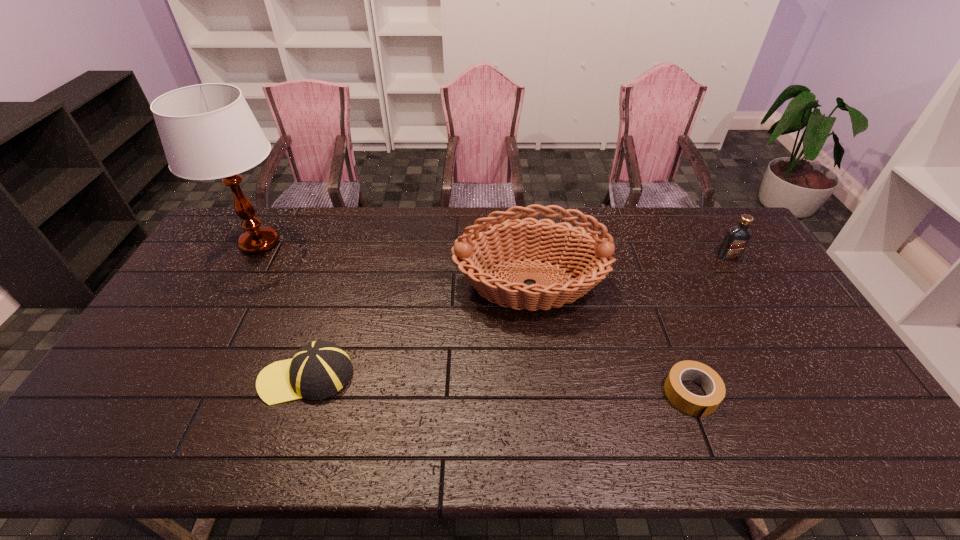
This screenshot has height=540, width=960. Identify the location of the leftmost object. (208, 131).

You are a GUI agent. You are given a task and a screenshot of the screen. Output one action in this format:
    pyautogui.click(x=<x>, y=<y>)
    Task: Click on the table lamp
    This screenshot has width=960, height=540.
    Given the screenshot: What is the action you would take?
    pyautogui.click(x=208, y=131)

Find the location of `basket`. basket is located at coordinates 584,254.

Where is `the third object from left to right`? This screenshot has width=960, height=540. the third object from left to right is located at coordinates (584, 254).

In order to click on the rightmost object in this screenshot , I will do `click(736, 239)`.

You are a GUI agent. You are given a task and a screenshot of the screen. Output one action in this format:
    pyautogui.click(x=<x>, y=<y>)
    Task: Click on the vodka
    This screenshot has width=960, height=540.
    Given the screenshot: What is the action you would take?
    pyautogui.click(x=736, y=239)

Locate an element on the screen. The width and height of the screenshot is (960, 540). baseball cap is located at coordinates (320, 369).

The image size is (960, 540). Identify the location of the fourth object from right to left. (320, 369).

Image resolution: width=960 pixels, height=540 pixels. In order to click on the shortest object in this screenshot , I will do `click(687, 402)`.

The image size is (960, 540). In order to click on duct tape in this screenshot , I will do `click(687, 402)`.